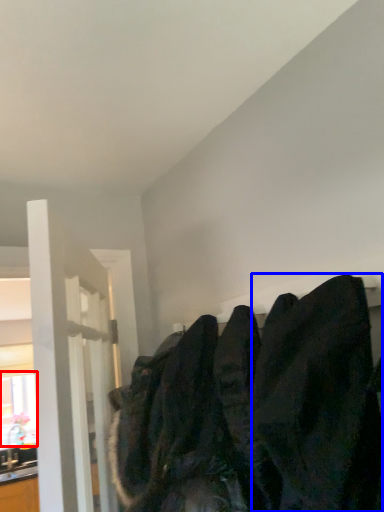
Question: Which of the following is the closest to the observer, window (highlighted by a red box) or clothing (highlighted by a blue box)?

Choices:
 (A) window
 (B) clothing

Answer: (B)